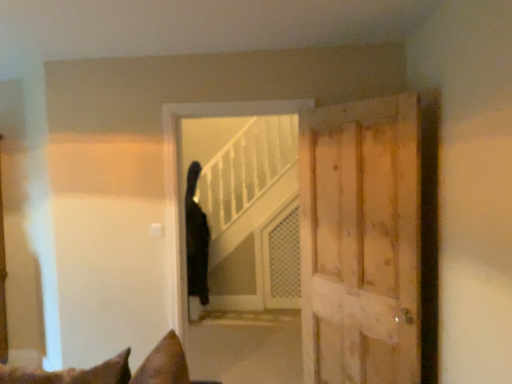
Question: Could black fur cat at center be considered to be inside white mesh screen door at center?

Choices:
 (A) no
 (B) yes

Answer: (A)

Question: Does white mesh screen door at center lie behind black fur cat at center?

Choices:
 (A) no
 (B) yes

Answer: (B)

Question: Is white mesh screen door at center touching black fur cat at center?

Choices:
 (A) no
 (B) yes

Answer: (A)

Question: Does white mesh screen door at center appear on the left side of black fur cat at center?

Choices:
 (A) yes
 (B) no

Answer: (B)

Question: From the image's perspective, does white mesh screen door at center appear lower than black fur cat at center?

Choices:
 (A) no
 (B) yes

Answer: (B)

Question: Is black fur cat at center at the back of white mesh screen door at center?

Choices:
 (A) yes
 (B) no

Answer: (B)

Question: Does light brown wooden door at right have a lesser width compared to black fur cat at center?

Choices:
 (A) no
 (B) yes

Answer: (B)

Question: Is light brown wooden door at right with black fur cat at center?

Choices:
 (A) yes
 (B) no

Answer: (B)

Question: From a real-world perspective, is light brown wooden door at right beneath black fur cat at center?

Choices:
 (A) no
 (B) yes

Answer: (A)

Question: From a real-world perspective, is light brown wooden door at right located higher than black fur cat at center?

Choices:
 (A) no
 (B) yes

Answer: (B)

Question: Is light brown wooden door at right not near black fur cat at center?

Choices:
 (A) yes
 (B) no

Answer: (A)

Question: From the image's perspective, is light brown wooden door at right beneath black fur cat at center?

Choices:
 (A) yes
 (B) no

Answer: (B)

Question: Is white mesh screen door at center surrounded by light brown wooden door at right?

Choices:
 (A) yes
 (B) no

Answer: (B)